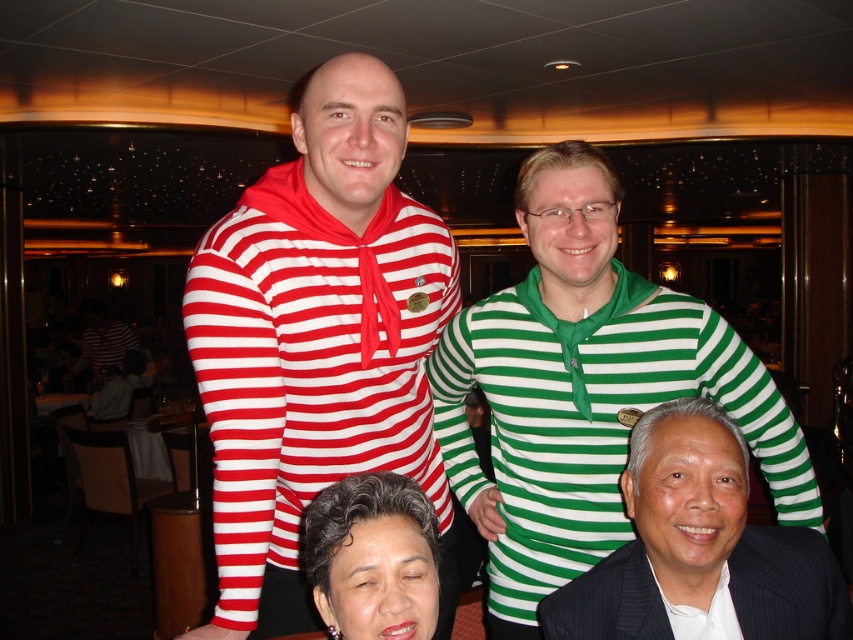
You are a photographer at the event and want to take a photo that includes both the green striped shirt at upper right and the smooth black hair at lower center. Which object should you focus on first to ensure both are in frame?

You should focus on the smooth black hair at lower center first because the green striped shirt at upper right is located above it, so adjusting the frame from the bottom up will capture both.

Based on the photo, you are standing at the center of the room and want to take a photo of the green striped shirt at upper right. If your camera has a maximum focus range of 4 feet, will you be able to capture it clearly?

The green striped shirt at upper right is 4.47 feet away from the camera. Since the camera can only focus up to 4 feet, it will not be able to capture the green striped shirt at upper right clearly.

You are a photographer trying to capture a clear photo of both the matte red and white striped hoodie at center and the green striped shirt at center. Since you can only focus on one object at a time, which one should you focus on first to ensure the other is also in focus?

You should focus on the matte red and white striped hoodie at center first because it is closer to the viewer than the green striped shirt at center. By focusing on the closer object, the farther one may still be within the depth of field, making both appear clearer.